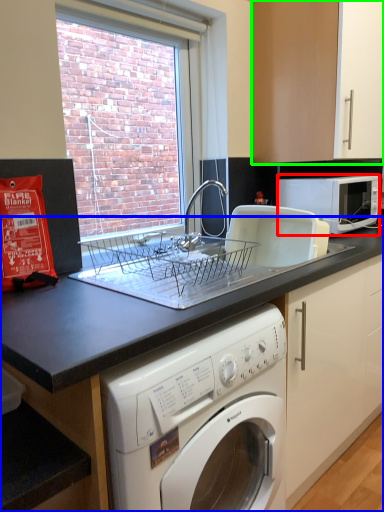
Question: Which object is the closest to the microwave oven (highlighted by a red box)? Choose among these: countertop (highlighted by a blue box) or cabinetry (highlighted by a green box).

Choices:
 (A) countertop
 (B) cabinetry

Answer: (B)